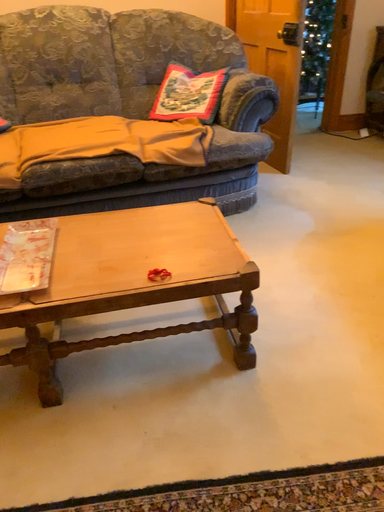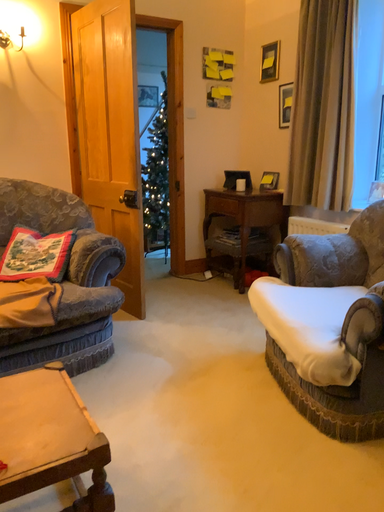
Question: How did the camera likely rotate when shooting the video?

Choices:
 (A) rotated right
 (B) rotated left

Answer: (A)